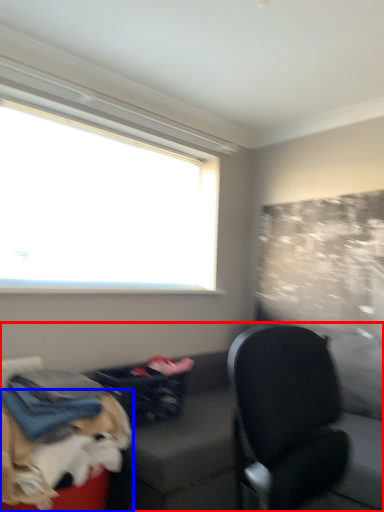
Question: Which object appears closest to the camera in this image, studio couch (highlighted by a red box) or dog (highlighted by a blue box)?

Choices:
 (A) studio couch
 (B) dog

Answer: (B)